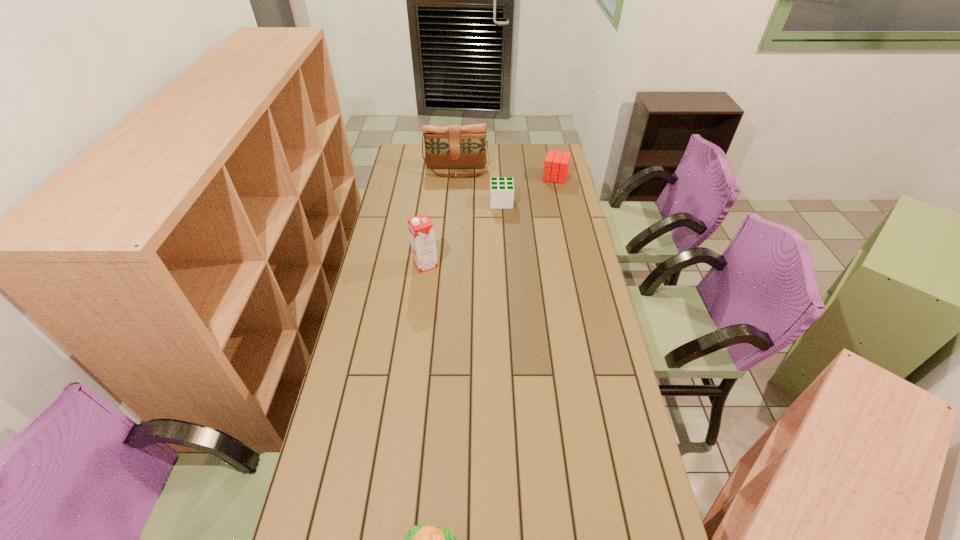
At what (x,y) coordinates should I click in order to perform the action: click on vacant space situated on the red face of the left cube. Please return your answer as a coordinate pair (x, y). The width and height of the screenshot is (960, 540). Looking at the image, I should click on (445, 202).

Identify the location of free space located 0.120m on the red face of the left cube. (465, 202).

What are the coordinates of `object that is positioned at the far edge` in the screenshot? It's located at (454, 146).

This screenshot has height=540, width=960. I want to click on object located in the left edge section of the desktop, so click(x=454, y=146).

This screenshot has width=960, height=540. Find the location of `object that is at the right edge`. object that is at the right edge is located at coordinates (556, 164).

Image resolution: width=960 pixels, height=540 pixels. I want to click on object at the far left corner, so click(x=454, y=146).

Find the location of `free space at the left edge of the desktop`. free space at the left edge of the desktop is located at coordinates (x=358, y=321).

This screenshot has width=960, height=540. Identify the location of vacant space at the right edge of the desktop. (565, 319).

Image resolution: width=960 pixels, height=540 pixels. I want to click on free spot at the far left corner of the desktop, so click(407, 156).

Find the location of a particular element. This screenshot has height=540, width=960. vacant space that's between the rightmost object and the third nearest object is located at coordinates (528, 190).